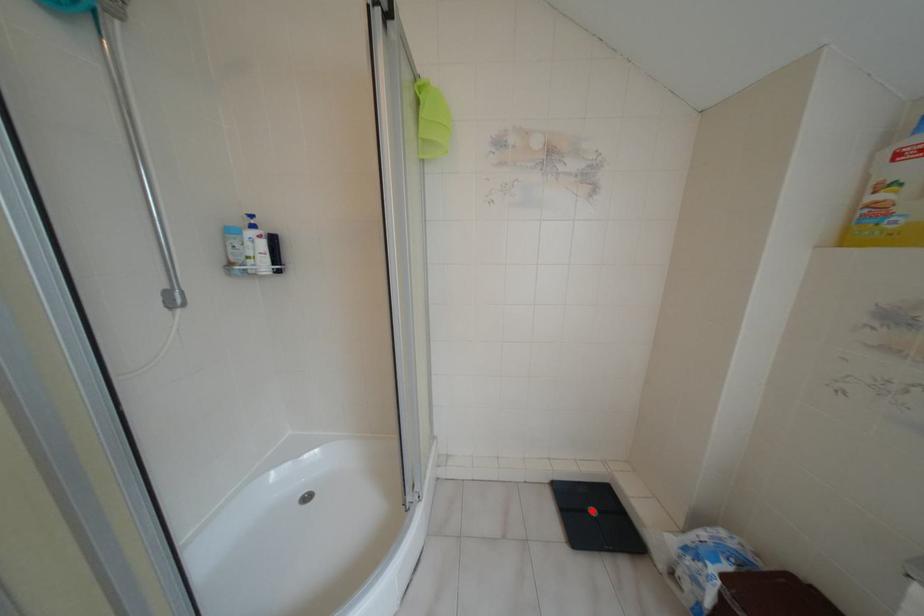
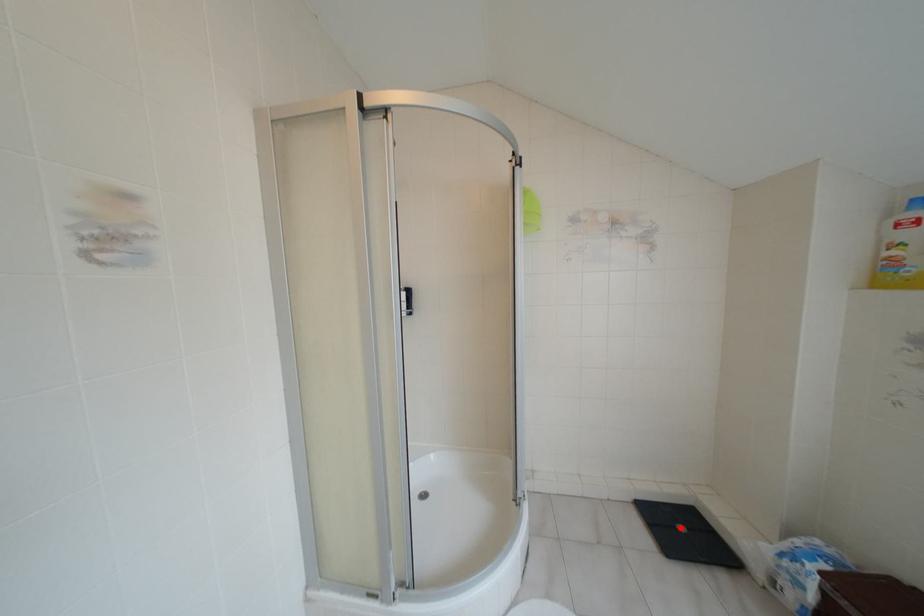
I am providing you with two images of the same scene from different viewpoints. A red point is marked on the first image and another point is marked on the second image. Is the red point in image1 aligned with the point shown in image2?

Yes